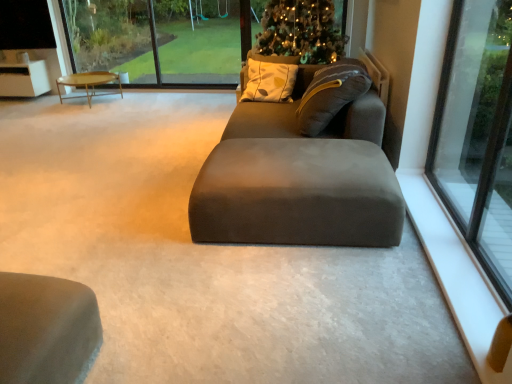
Question: Considering the positions of suede gray bean bag at center and wooden polished coffee table at left in the image, is suede gray bean bag at center taller or shorter than wooden polished coffee table at left?

Choices:
 (A) short
 (B) tall

Answer: (B)

Question: Considering the relative positions of suede gray bean bag at center and wooden polished coffee table at left in the image provided, is suede gray bean bag at center to the left or to the right of wooden polished coffee table at left?

Choices:
 (A) right
 (B) left

Answer: (A)

Question: Considering the real-world distances, which object is closest to the transparent glass window at upper center?

Choices:
 (A) suede gray bean bag at center
 (B) wooden polished coffee table at left
 (C) white smooth window sill at lower right
 (D) green plastic swing set at upper center
 (E) suede-like gray studio couch at center

Answer: (D)

Question: Estimate the real-world distances between objects in this image. Which object is closer to the suede-like gray studio couch at center?

Choices:
 (A) transparent glass window at right
 (B) wooden polished coffee table at left
 (C) suede gray bean bag at center
 (D) transparent glass window at upper center
 (E) green plastic swing set at upper center

Answer: (C)